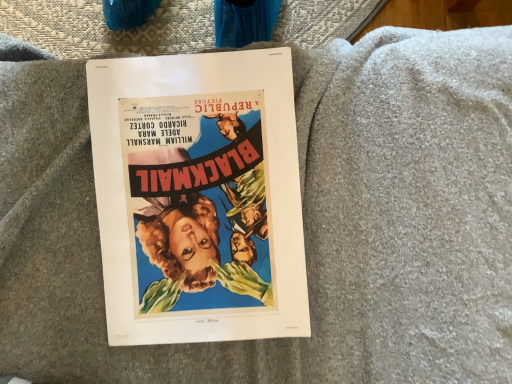
Where is `empty space that is ontop of matte paper poster at center`? empty space that is ontop of matte paper poster at center is located at coordinates (190, 182).